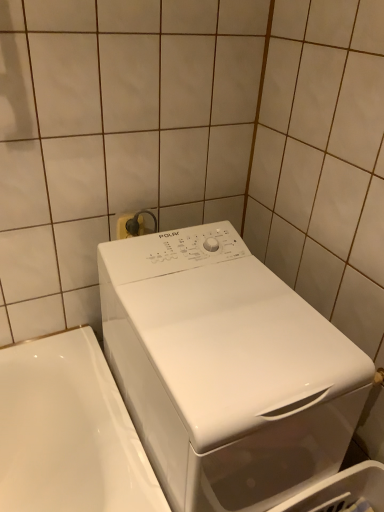
The width and height of the screenshot is (384, 512). What do you see at coordinates (226, 369) in the screenshot?
I see `white glossy washing machine at center` at bounding box center [226, 369].

At what (x,y) coordinates should I click in order to perform the action: click on white glossy washing machine at center. Please return your answer as a coordinate pair (x, y). This screenshot has width=384, height=512. Looking at the image, I should click on (226, 369).

The width and height of the screenshot is (384, 512). Describe the element at coordinates (123, 226) in the screenshot. I see `white plastic electric outlet at upper center` at that location.

The image size is (384, 512). In order to click on white plastic electric outlet at upper center in this screenshot , I will do pyautogui.click(x=123, y=226).

The width and height of the screenshot is (384, 512). What are the coordinates of `white glossy washing machine at center` in the screenshot? It's located at (226, 369).

Between white plastic electric outlet at upper center and white glossy washing machine at center, which one appears on the left side from the viewer's perspective?

Positioned to the left is white plastic electric outlet at upper center.

Which is in front, white plastic electric outlet at upper center or white glossy washing machine at center?

white glossy washing machine at center is more forward.

Is point (141, 227) closer or farther from the camera than point (162, 436)?

Point (141, 227) appears to be farther away from the viewer than point (162, 436).

From the image's perspective, relative to white glossy washing machine at center, is white plastic electric outlet at upper center above or below?

From the image's perspective, white plastic electric outlet at upper center appears above white glossy washing machine at center.

From a real-world perspective, which is physically below, white plastic electric outlet at upper center or white glossy washing machine at center?

white glossy washing machine at center is physically lower.

Considering the sizes of white plastic electric outlet at upper center and white glossy washing machine at center in the image, is white plastic electric outlet at upper center wider or thinner than white glossy washing machine at center?

Clearly, white plastic electric outlet at upper center has less width compared to white glossy washing machine at center.

Which of these two, white plastic electric outlet at upper center or white glossy washing machine at center, stands shorter?

white plastic electric outlet at upper center is shorter.

Does white plastic electric outlet at upper center have a smaller size compared to white glossy washing machine at center?

Yes.

Would you say white glossy washing machine at center is part of white plastic electric outlet at upper center's contents?

Definitely not — white glossy washing machine at center is not inside white plastic electric outlet at upper center.

Does white plastic electric outlet at upper center touch white glossy washing machine at center?

No, white plastic electric outlet at upper center is not in contact with white glossy washing machine at center.

Does white plastic electric outlet at upper center turn towards white glossy washing machine at center?

Yes, white plastic electric outlet at upper center is aimed at white glossy washing machine at center.

How many degrees apart are the facing directions of white plastic electric outlet at upper center and white glossy washing machine at center?

The angle between the facing direction of white plastic electric outlet at upper center and the facing direction of white glossy washing machine at center is 0.00343 degrees.

How much distance is there between white plastic electric outlet at upper center and white glossy washing machine at center?

The distance of white plastic electric outlet at upper center from white glossy washing machine at center is 19.73 inches.

At what (x,y) coordinates should I click in order to perform the action: click on electric outlet lying above the white glossy washing machine at center (from the image's perspective). Please return your answer as a coordinate pair (x, y). Looking at the image, I should click on (123, 226).

Is white glossy washing machine at center to the left or to the right of white plastic electric outlet at upper center in the image?

Clearly, white glossy washing machine at center is on the right of white plastic electric outlet at upper center in the image.

Is white glossy washing machine at center positioned in front of white plastic electric outlet at upper center?

That is True.

Considering the points (241, 351) and (140, 218), which point is in front, point (241, 351) or point (140, 218)?

The point (241, 351) is closer.

From the image's perspective, is white glossy washing machine at center under white plastic electric outlet at upper center?

Yes, from the image's perspective, white glossy washing machine at center is beneath white plastic electric outlet at upper center.

From a real-world perspective, relative to white plastic electric outlet at upper center, is white glossy washing machine at center vertically above or below?

In terms of real-world spatial position, white glossy washing machine at center is below white plastic electric outlet at upper center.

Considering the sizes of white glossy washing machine at center and white plastic electric outlet at upper center in the image, is white glossy washing machine at center wider or thinner than white plastic electric outlet at upper center?

In the image, white glossy washing machine at center appears to be wider than white plastic electric outlet at upper center.

In terms of height, does white glossy washing machine at center look taller or shorter compared to white plastic electric outlet at upper center?

In the image, white glossy washing machine at center appears to be taller than white plastic electric outlet at upper center.

Considering the relative sizes of white glossy washing machine at center and white plastic electric outlet at upper center in the image provided, is white glossy washing machine at center smaller than white plastic electric outlet at upper center?

Incorrect, white glossy washing machine at center is not smaller in size than white plastic electric outlet at upper center.

Is white glossy washing machine at center spatially inside white plastic electric outlet at upper center, or outside of it?

white glossy washing machine at center is not enclosed by white plastic electric outlet at upper center.

Can you see white glossy washing machine at center touching white plastic electric outlet at upper center?

No, white glossy washing machine at center is not next to white plastic electric outlet at upper center.

Does white glossy washing machine at center turn towards white plastic electric outlet at upper center?

No, white glossy washing machine at center is not oriented towards white plastic electric outlet at upper center.

I want to click on washing machine that appears below the white plastic electric outlet at upper center (from the image's perspective), so click(226, 369).

Locate an element on the screen. washing machine in front of the white plastic electric outlet at upper center is located at coordinates (226, 369).

You are a GUI agent. You are given a task and a screenshot of the screen. Output one action in this format:
    pyautogui.click(x=<x>, y=<y>)
    Task: Click on the electric outlet that appears behind the white glossy washing machine at center
    
    Given the screenshot: What is the action you would take?
    pyautogui.click(x=123, y=226)